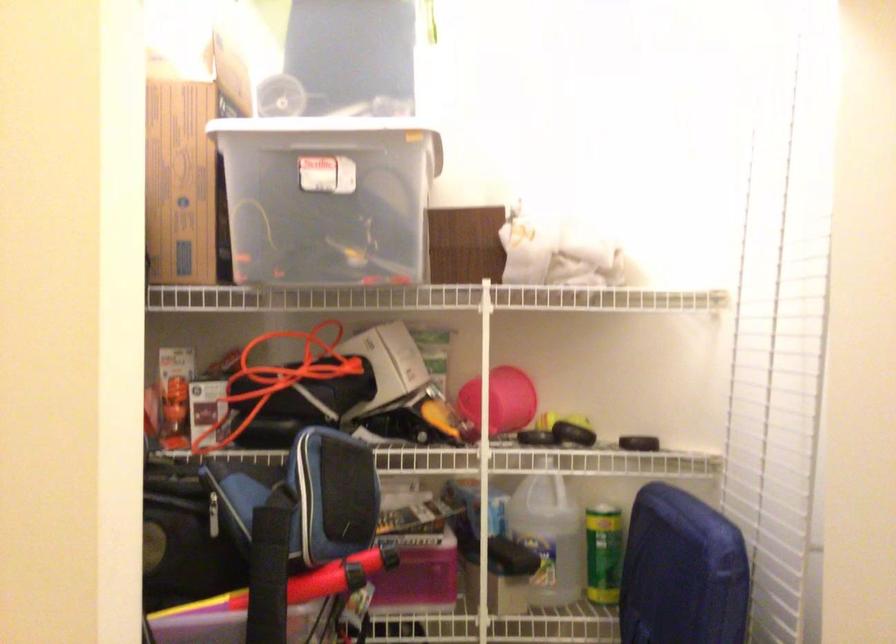
Question: The camera is either moving clockwise (left) or counter-clockwise (right) around the object. The first image is from the beginning of the video and the second image is from the end. Is the camera moving left or right when shooting the video?

Choices:
 (A) Left
 (B) Right

Answer: (A)